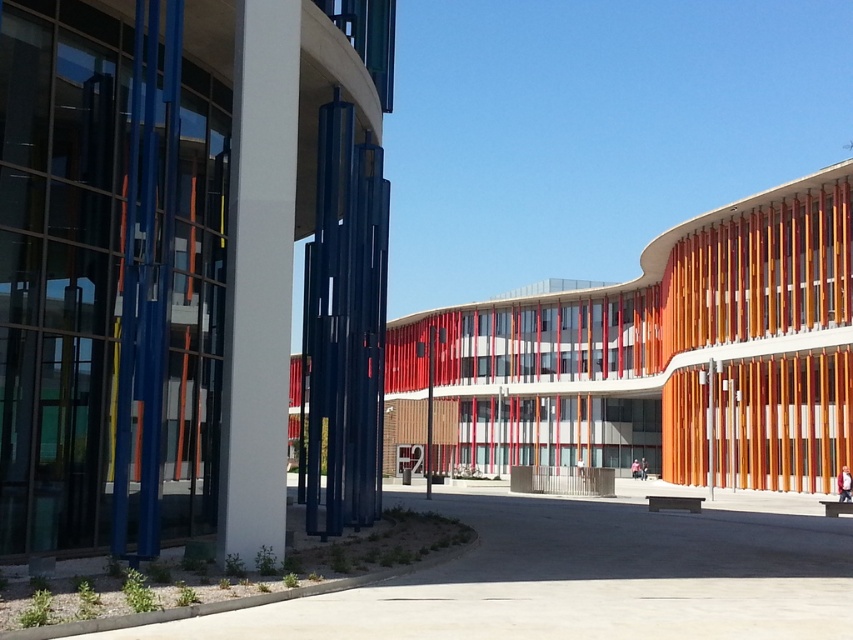
You are an architect designing a new sculpture to be placed between the polished glass wind chimes at center and the orange wood building at center. The sculpture will be 1.2 meters wide. Can the sculpture fit between them without overlapping either object?

The polished glass wind chimes at center has a lesser width compared to the orange wood building at center. Since the sculpture is 1.2 meters wide, it can fit between them as long as the distance between the two objects is at least 1.2 meters. However, the exact feasibility depends on the actual spacing between the two objects, which isn not specified in the provided information.

You are standing in the modern architectural scene described. There is a point marked at coordinates [666,353]. What does this point indicate?

The point at coordinates [666,353] marks the orange wood building at center.